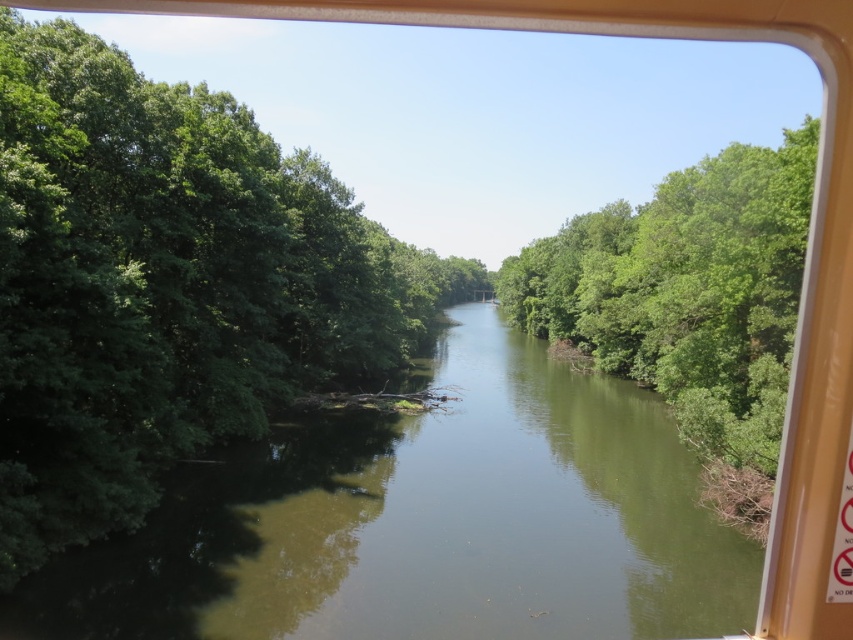
The width and height of the screenshot is (853, 640). What do you see at coordinates (425, 524) in the screenshot? I see `green smooth water at center` at bounding box center [425, 524].

Which is in front, point (657, 497) or point (723, 317)?

Point (657, 497)

Which is in front, point (315, 572) or point (738, 429)?

Point (315, 572) is more forward.

In order to click on green smooth water at center in this screenshot , I will do `click(425, 524)`.